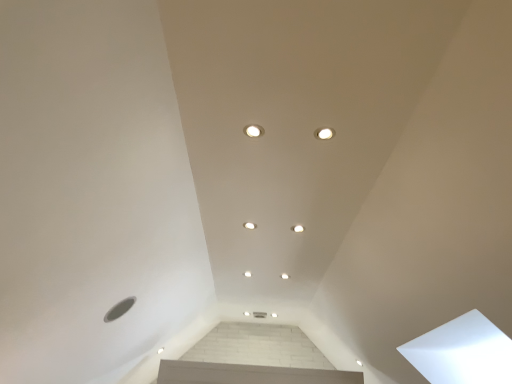
Question: Considering the positions of white glossy dot at center, positioned as the 3th dot in back-to-front order, and white glossy light fixture at upper center, arranged as the 1th dot when viewed from the top, in the image, is white glossy dot at center, positioned as the 3th dot in back-to-front order, taller or shorter than white glossy light fixture at upper center, arranged as the 1th dot when viewed from the top,?

Choices:
 (A) tall
 (B) short

Answer: (A)

Question: From the image's perspective, is white glossy dot at center, marked as the third dot in a bottom-to-top arrangement, positioned above or below white glossy light fixture at upper center, which is the 6th dot from bottom to top?

Choices:
 (A) below
 (B) above

Answer: (A)

Question: Which object is positioned farthest from the white glossy light fixture at center, which appears as the second dot when viewed from the back?

Choices:
 (A) white glossy light fixture at upper center, which ranks as the 1th dot in right-to-left order
 (B) white glossy light fixture at upper center, which is counted as the 4th dot, starting from the right
 (C) white glossy dot at center, positioned as the 3th dot in back-to-front order
 (D) white glossy light fixture at center, placed as the 2th dot when sorted from left to right
 (E) white glossy light fixture at center, which ranks as the third dot in top-to-bottom order

Answer: (A)

Question: Which object is positioned closest to the white glossy light fixture at upper center, which ranks as the 3th dot in left-to-right order?

Choices:
 (A) white glossy light fixture at center, the fifth dot in the front-to-back sequence
 (B) white glossy dot at center, marked as the third dot in a bottom-to-top arrangement
 (C) white glossy light fixture at center, the 5th dot viewed from the left
 (D) white glossy light fixture at upper center, arranged as the 1th dot when viewed from the top
 (E) white glossy light fixture at center, which is the 2th dot from top to bottom

Answer: (A)